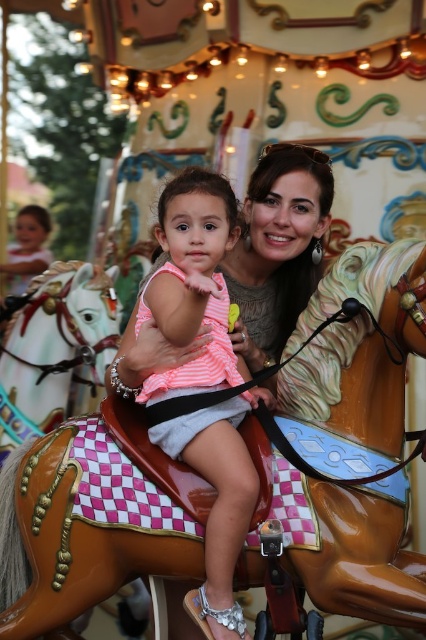
Question: Can you confirm if shiny brown horse at center is smaller than polished white horse at center?

Choices:
 (A) yes
 (B) no

Answer: (B)

Question: Which object is farther from the camera taking this photo?

Choices:
 (A) pink striped fabric at center
 (B) shiny brown horse at center
 (C) polished white horse at center

Answer: (C)

Question: Among these objects, which one is nearest to the camera?

Choices:
 (A) shiny brown horse at center
 (B) pink striped fabric at center

Answer: (A)

Question: Among these objects, which one is nearest to the camera?

Choices:
 (A) pink striped fabric at center
 (B) polished white horse at center

Answer: (A)

Question: Can you confirm if pink striped fabric at center is smaller than polished white horse at center?

Choices:
 (A) no
 (B) yes

Answer: (B)

Question: Is shiny brown horse at center positioned in front of pink striped fabric at center?

Choices:
 (A) no
 (B) yes

Answer: (B)